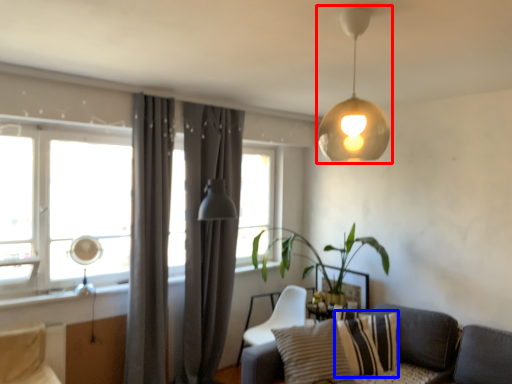
Question: Which of the following is the closest to the observer, lamp (highlighted by a red box) or pillow (highlighted by a blue box)?

Choices:
 (A) lamp
 (B) pillow

Answer: (A)